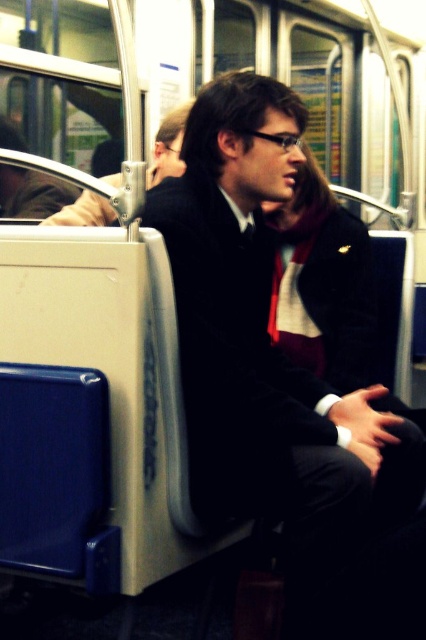
Question: Considering the relative positions of matte black jacket at center and matte black jacket at upper left in the image provided, where is matte black jacket at center located with respect to matte black jacket at upper left?

Choices:
 (A) right
 (B) left

Answer: (A)

Question: Is matte black jacket at center to the left of matte black jacket at upper left from the viewer's perspective?

Choices:
 (A) no
 (B) yes

Answer: (A)

Question: Can you confirm if matte black jacket at center is thinner than matte black jacket at upper left?

Choices:
 (A) yes
 (B) no

Answer: (B)